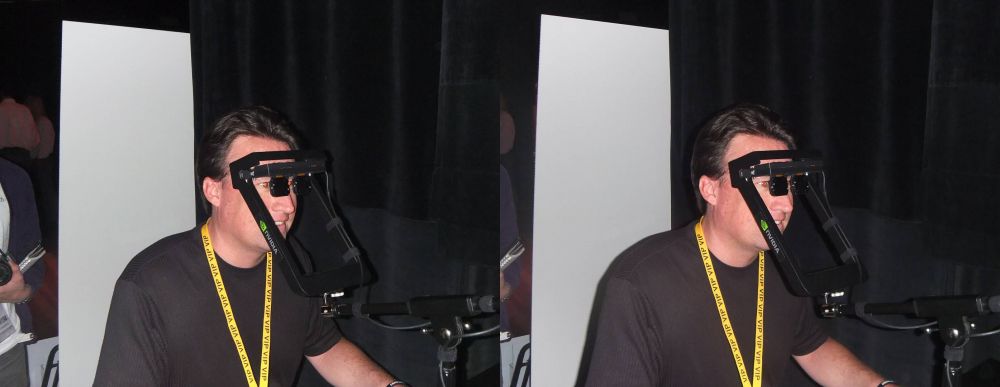
This screenshot has width=1000, height=387. I want to click on stand, so click(448, 308).